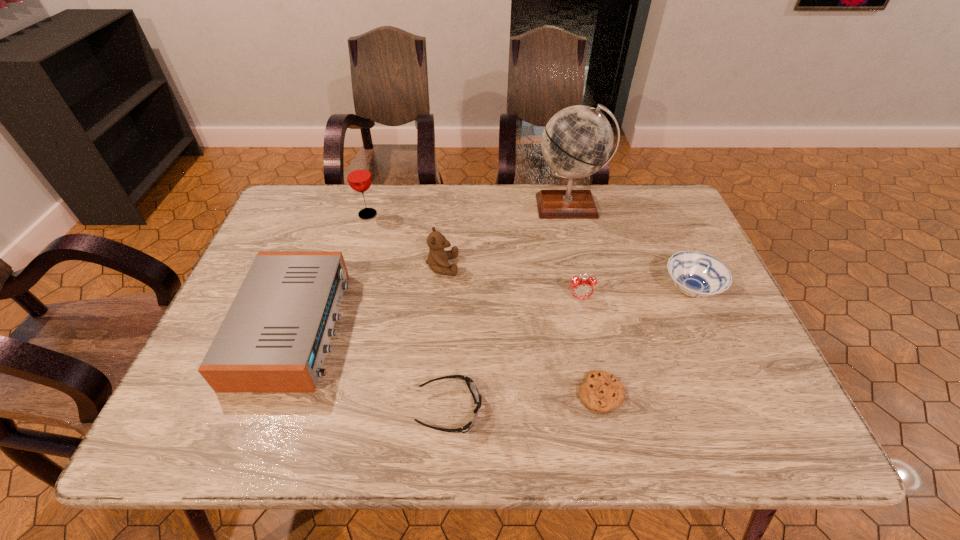
This screenshot has height=540, width=960. In order to click on the third closest object to the glass in this screenshot , I will do `click(577, 141)`.

Identify the location of object that ranks as the sixth closest to the soup bowl. This screenshot has width=960, height=540. (274, 338).

Identify the location of vacant space that satisfies the following two spatial constraints: 1. at the equator of the tallest object; 2. on the right side of the rightmost object. This screenshot has width=960, height=540. (588, 290).

Find the location of a particular element. The image size is (960, 540). vacant position in the image that satisfies the following two spatial constraints: 1. on the front side of the soup bowl; 2. on the lenses of the sunglasses is located at coordinates (744, 410).

This screenshot has height=540, width=960. I want to click on free spot that satisfies the following two spatial constraints: 1. at the equator of the globe; 2. on the front panel of the radio receiver, so click(597, 327).

Where is `free spot that satisfies the following two spatial constraints: 1. at the equator of the tallest object; 2. on the lenses of the second shortest object`? free spot that satisfies the following two spatial constraints: 1. at the equator of the tallest object; 2. on the lenses of the second shortest object is located at coordinates (616, 410).